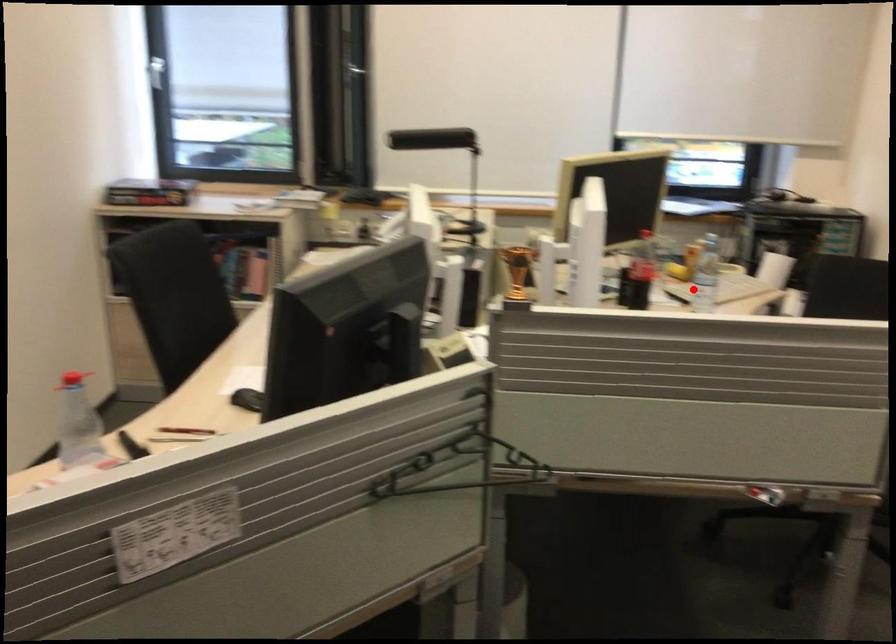
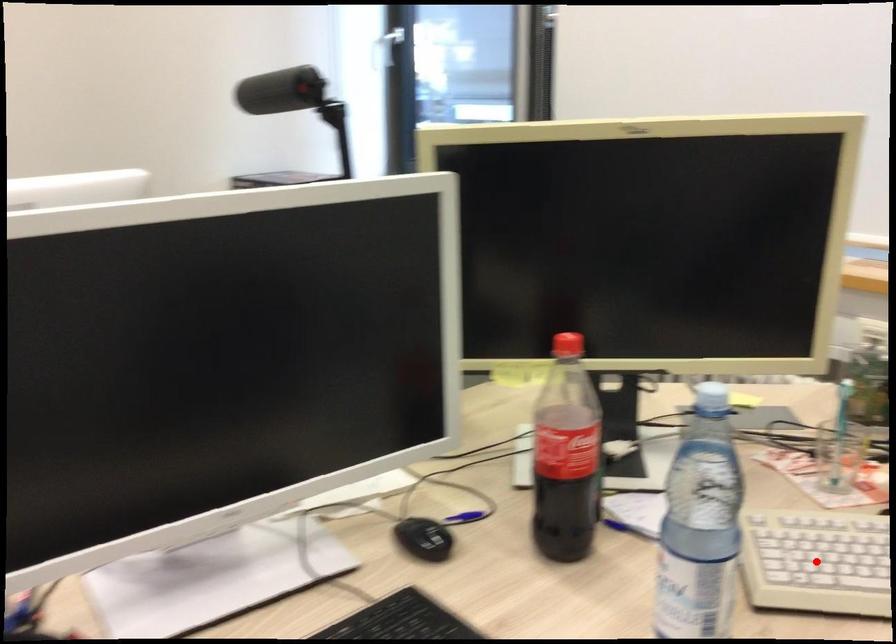
I am providing you with two images of the same scene from different viewpoints. A red point is marked on the first image and another point is marked on the second image. Is the red point in image1 aligned with the point shown in image2?

Yes